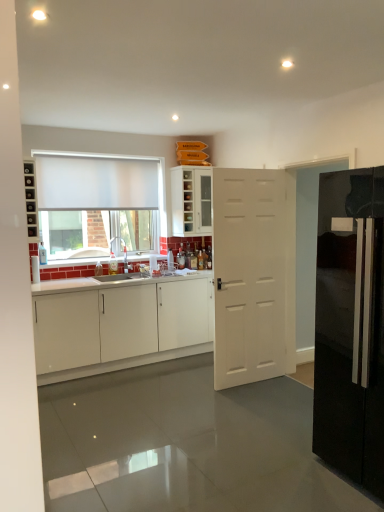
Question: Is matte black shelves at left wider or thinner than white matte curtain at upper left?

Choices:
 (A) wide
 (B) thin

Answer: (A)

Question: From a real-world perspective, relative to white matte curtain at upper left, is matte black shelves at left vertically above or below?

Choices:
 (A) below
 (B) above

Answer: (A)

Question: Estimate the real-world distances between objects in this image. Which object is farther from the glossy black refrigerator at right?

Choices:
 (A) white matte curtain at upper left
 (B) white matte door at center
 (C) white matte cabinet at left, which is the 1th cabinetry in bottom-to-top order
 (D) white matte window at upper left
 (E) matte black shelves at left

Answer: (A)

Question: Which of these objects is positioned closest to the white matte window at upper left?

Choices:
 (A) matte black shelves at left
 (B) white matte door at center
 (C) white glass cabinet at center, positioned as the first cabinetry in top-to-bottom order
 (D) white matte cabinet at left, the second cabinetry when ordered from top to bottom
 (E) glossy black refrigerator at right

Answer: (C)